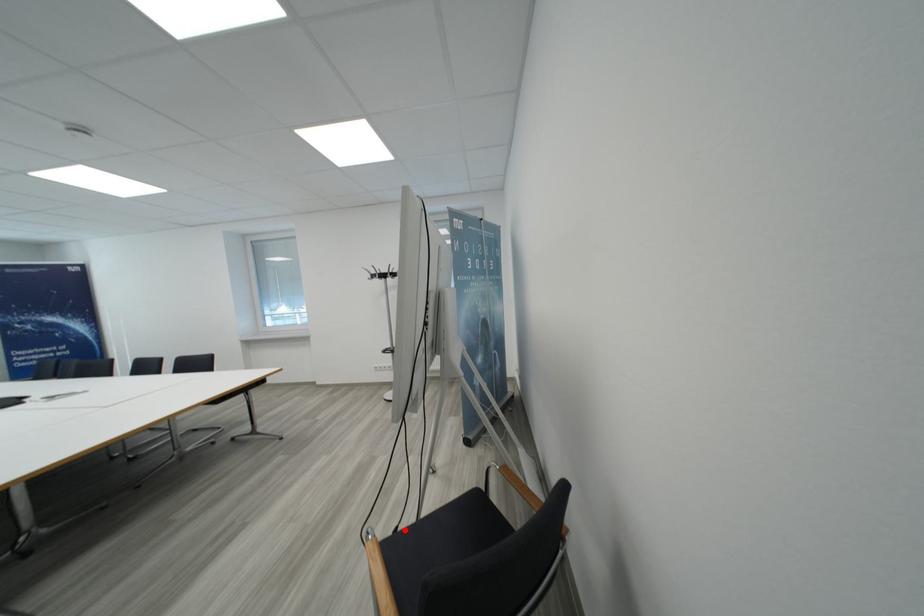
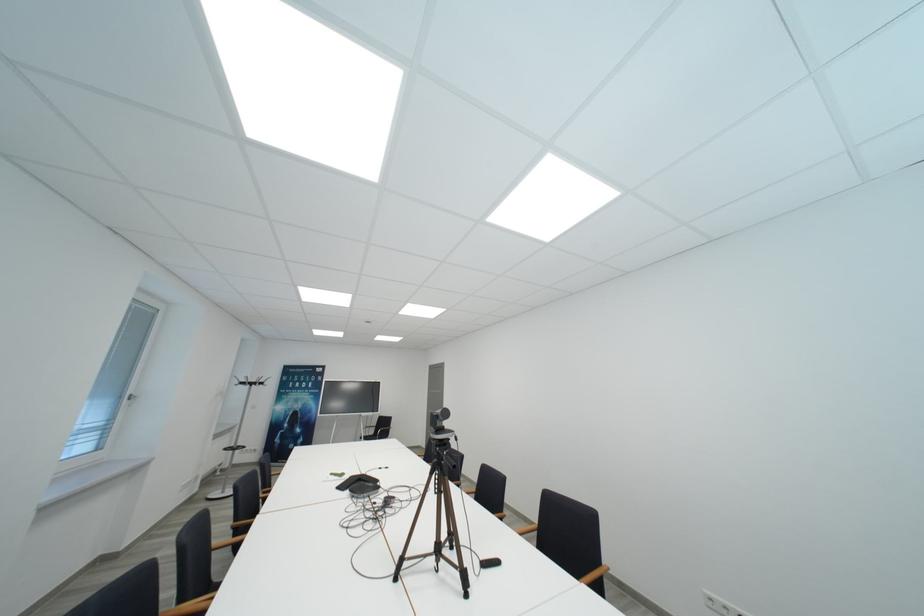
Question: I am providing you with two images of the same scene from different viewpoints. A red point is marked on the first image. At the location where the point appears in image 1, is it still visible in image 2?

Choices:
 (A) Yes
 (B) No

Answer: (B)